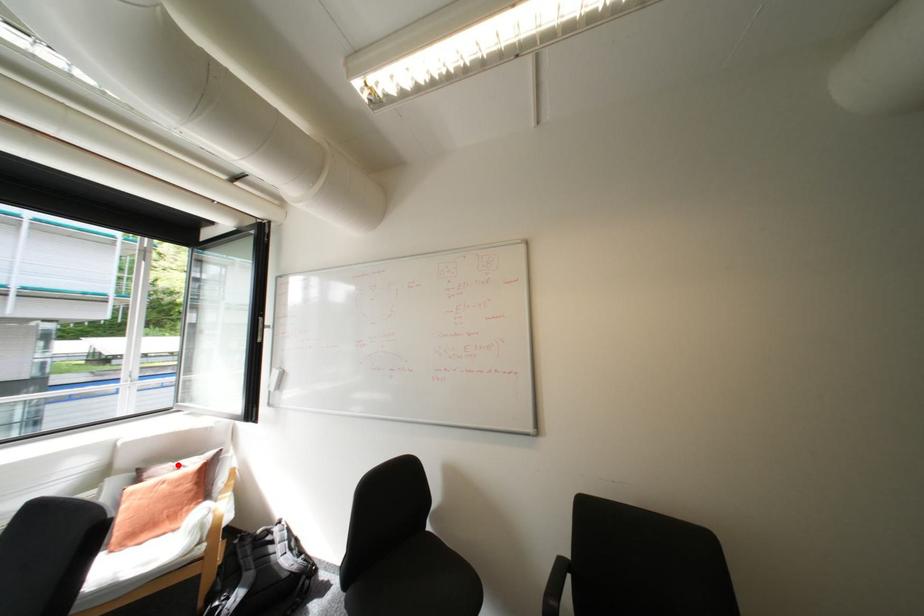
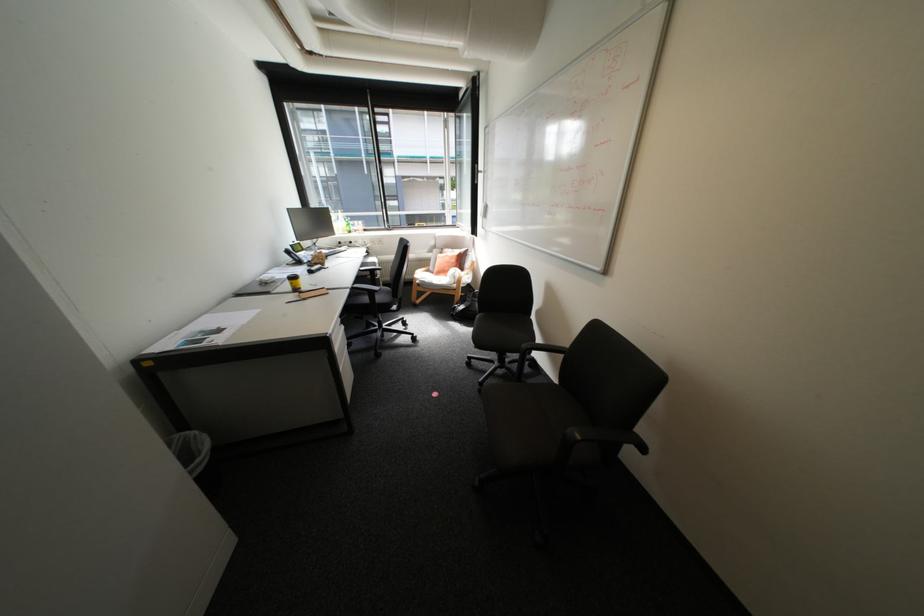
Locate, in the second image, the point that corresponds to the highlighted location in the first image.

(459, 249)